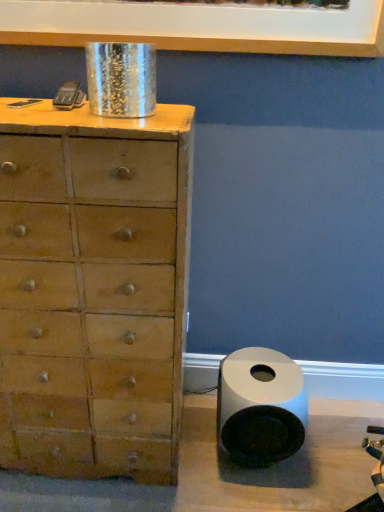
Question: Considering the positions of white glossy speaker at lower right and white glossy picture frame at upper center in the image, is white glossy speaker at lower right taller or shorter than white glossy picture frame at upper center?

Choices:
 (A) short
 (B) tall

Answer: (B)

Question: Would you say white glossy speaker at lower right is inside or outside white glossy picture frame at upper center?

Choices:
 (A) outside
 (B) inside

Answer: (A)

Question: Estimate the real-world distances between objects in this image. Which object is farther from the wooden chest of drawers at left?

Choices:
 (A) white glossy picture frame at upper center
 (B) white glossy speaker at lower right

Answer: (A)

Question: Which object is the farthest from the wooden chest of drawers at left?

Choices:
 (A) white glossy picture frame at upper center
 (B) white glossy speaker at lower right

Answer: (A)